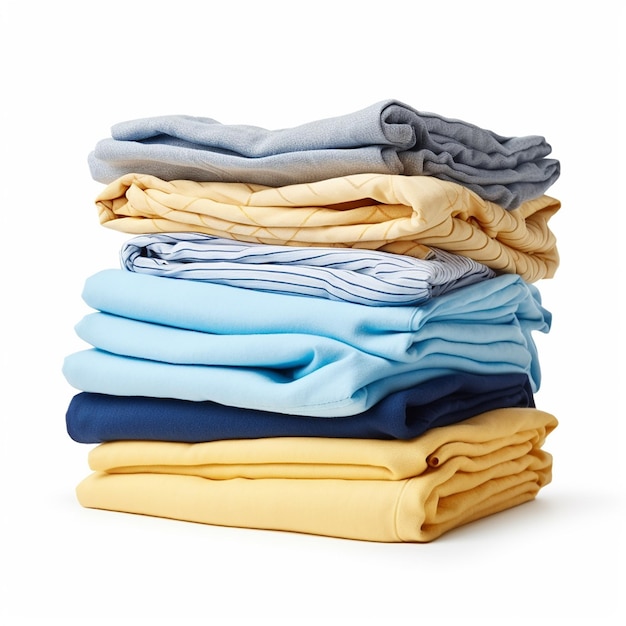
Where is `folded clothes`? folded clothes is located at coordinates (372, 506), (362, 469), (359, 418), (349, 387), (379, 332), (380, 280), (411, 235), (399, 136).